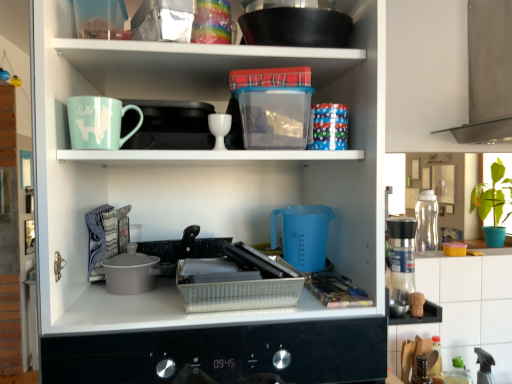
Question: Is blue plastic measuring cup at center in front of or behind black non-stick wok at upper center in the image?

Choices:
 (A) front
 (B) behind

Answer: (A)

Question: From a real-world perspective, relative to black non-stick wok at upper center, is blue plastic measuring cup at center vertically above or below?

Choices:
 (A) below
 (B) above

Answer: (A)

Question: Based on their relative distances, which object is nearer to the white tile at upper right?

Choices:
 (A) blue plastic measuring cup at center
 (B) black non-stick wok at upper center
 (C) matte ceramic mug at upper left
 (D) metallic grid tray at center, the second appliance in the back-to-front sequence
 (E) white glossy egg cup at upper center

Answer: (A)

Question: Based on their relative distances, which object is nearer to the metallic grid tray at center, which is the first appliance in left-to-right order?

Choices:
 (A) black non-stick wok at upper center
 (B) blue plastic measuring cup at center
 (C) matte ceramic mug at upper left
 (D) white glossy egg cup at upper center
 (E) translucent plastic spray bottle at lower right

Answer: (B)